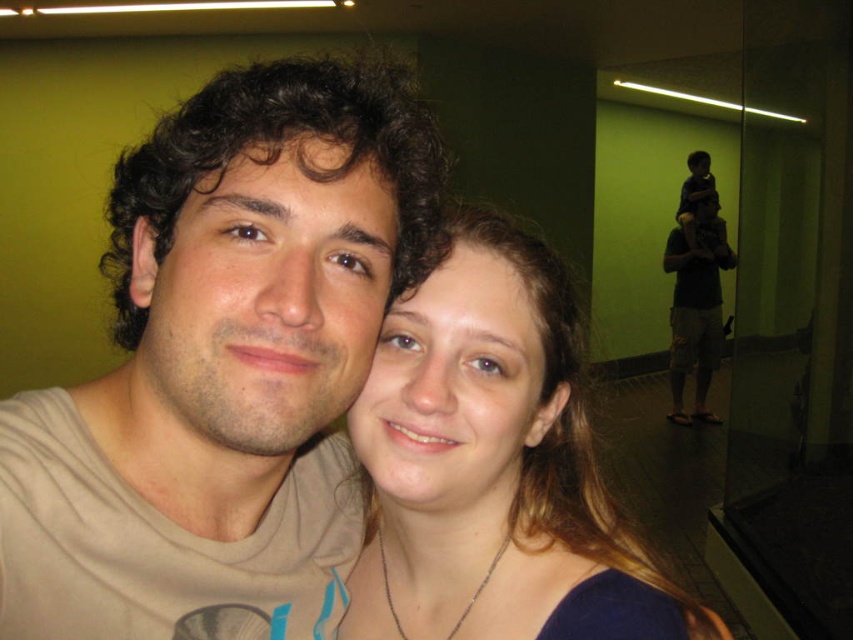
You are standing in front of the image and want to determine which of the two points, point (158, 612) or point (521, 301), is nearer to you. Based on the scene description, which point is closer?

Point (158, 612) is closer to the camera than point (521, 301), so it is the nearer one.

You are a photographer trying to adjust the lighting in the scene. You have a small light source that can only illuminate objects within a 10 cm radius. If you position the light directly at the matte gold necklace at center, will it also illuminate the matte beige shirt at center?

The distance between the matte beige shirt at center and the matte gold necklace at center is 10.72 centimeters. Since the light source can only illuminate within 10 cm, the matte beige shirt at center is just beyond the light radius and won t be illuminated.

You are standing in the museum and want to take a photo of the matte beige shirt at center. Where should you point your camera to capture it?

You should point your camera towards point 0.573 on the horizontal axis and point 0.264 on the vertical axis to capture the matte beige shirt at center.